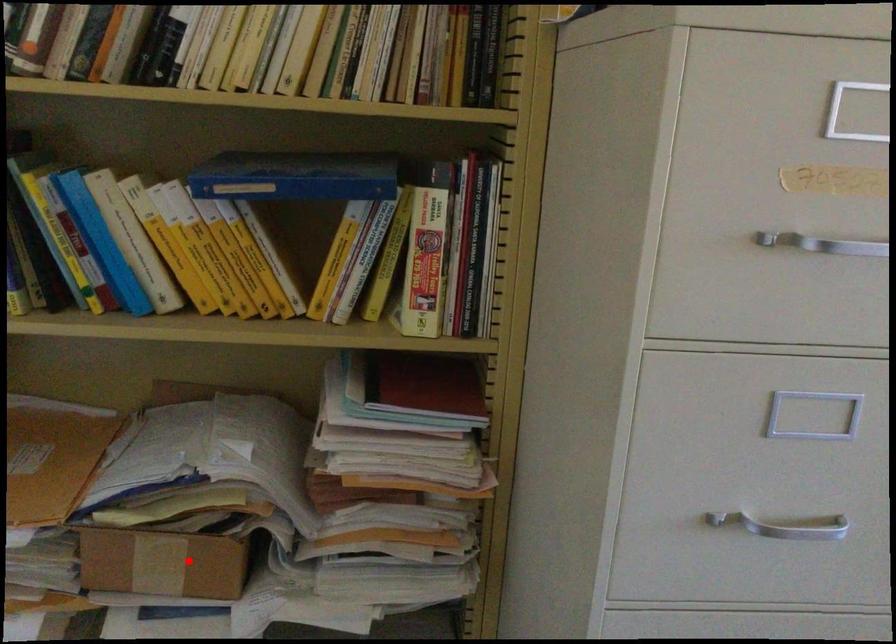
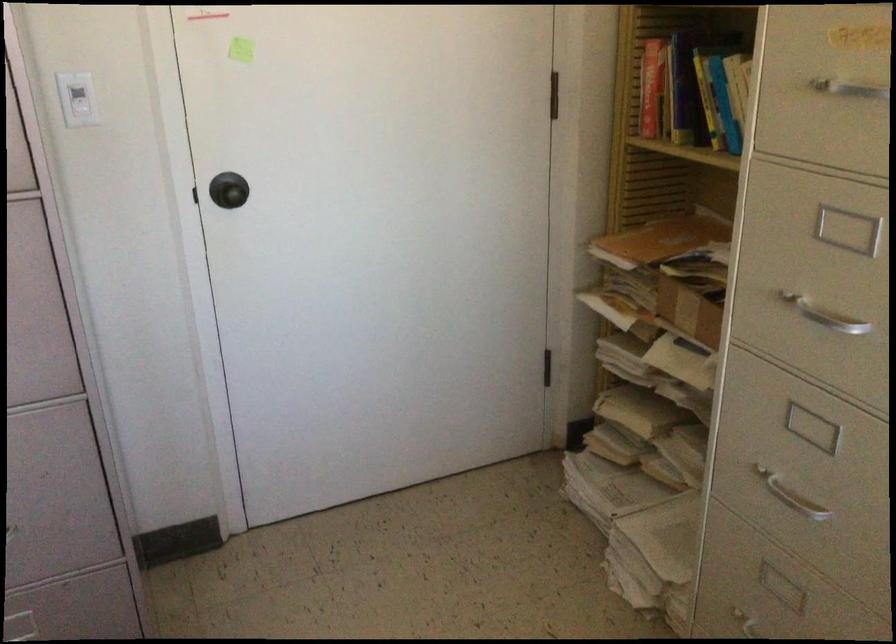
Question: I am providing you with two images of the same scene from different viewpoints. A red point is marked on the first image. Is the red point's position out of view in image 2?

Choices:
 (A) Yes
 (B) No

Answer: (B)